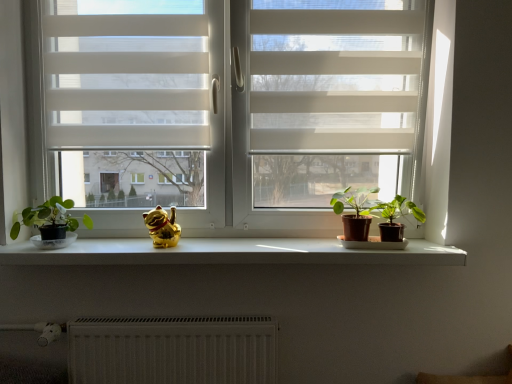
Locate an element on the screen. Image resolution: width=512 pixels, height=384 pixels. free space between green matte plant at left, the 3th houseplant when ordered from right to left, and gold shiny cat at center is located at coordinates (111, 247).